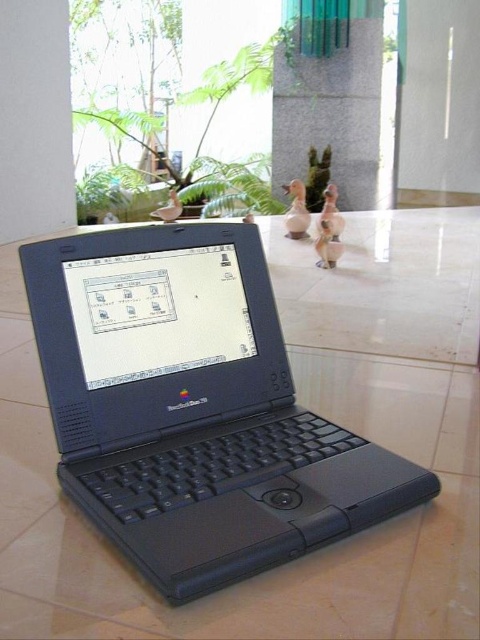
Question: Which point is farther to the camera?

Choices:
 (A) (295, 77)
 (B) (207, 304)
 (C) (295, 189)
 (D) (334, 196)

Answer: (A)

Question: Which point is closer to the camera?

Choices:
 (A) (69, 324)
 (B) (351, 116)

Answer: (A)

Question: Among these points, which one is nearest to the camera?

Choices:
 (A) (95, 237)
 (B) (333, 202)
 (C) (309, 216)

Answer: (A)

Question: Does gray stone pillar at center have a lesser width compared to matte ceramic duck at center?

Choices:
 (A) no
 (B) yes

Answer: (A)

Question: Can you confirm if black plastic laptop at center is bigger than matte brown duck at center?

Choices:
 (A) no
 (B) yes

Answer: (B)

Question: Does gray stone pillar at center appear under matte brown duck at center?

Choices:
 (A) yes
 (B) no

Answer: (B)